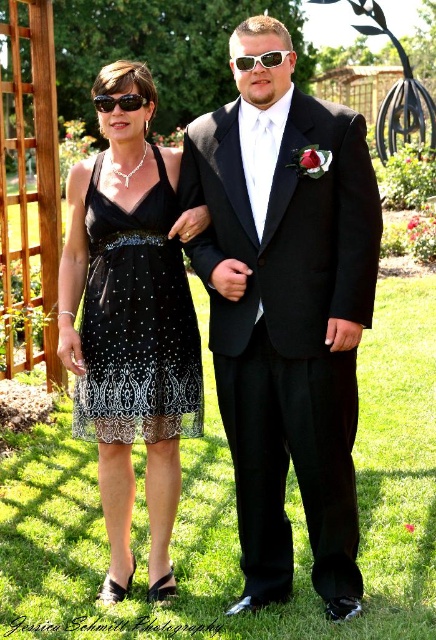
You are standing in the middle of the lawn and want to walk towards the closest point between point (419,412) and point (122,109). Which point should you walk towards?

Point (122,109) is closer to you than point (419,412), so you should walk towards point (122,109).

You are a photographer setting up for a photoshoot. You need to place a small tripod between the green grass at center and the black plastic sunglasses at upper left. According to the scene description, where should you position the tripod?

A: The green grass at center is positioned on the right side of black plastic sunglasses at upper left, so the tripod should be placed between them, aligning with the right side of the sunglasses and the left side of the grass.